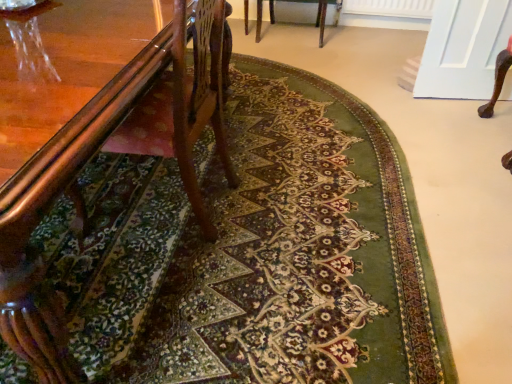
Question: In terms of width, does wooden chair at center, acting as the first chair starting from the back, look wider or thinner when compared to wooden chair at left, positioned as the 1th chair in bottom-to-top order?

Choices:
 (A) thin
 (B) wide

Answer: (A)

Question: Relative to wooden chair at left, arranged as the 2th chair when viewed from the right, is wooden chair at center, which is the first chair in right-to-left order, in front or behind?

Choices:
 (A) behind
 (B) front

Answer: (A)

Question: From a real-world perspective, is wooden chair at center, which is the second chair from front to back, positioned above or below wooden chair at left, arranged as the second chair when viewed from the top?

Choices:
 (A) below
 (B) above

Answer: (A)

Question: From a real-world perspective, is wooden chair at left, arranged as the second chair when viewed from the top, above or below wooden chair at center, which is the second chair from front to back?

Choices:
 (A) above
 (B) below

Answer: (A)

Question: Based on their positions, is wooden chair at left, the second chair viewed from the back, located to the left or right of wooden chair at center, acting as the first chair starting from the back?

Choices:
 (A) left
 (B) right

Answer: (A)

Question: From the image's perspective, is wooden chair at left, the 1th chair when ordered from left to right, above or below wooden chair at center, which is the second chair from front to back?

Choices:
 (A) above
 (B) below

Answer: (B)

Question: Considering the positions of wooden chair at left, positioned as the 1th chair in bottom-to-top order, and wooden chair at center, which is counted as the 2th chair, starting from the bottom, in the image, is wooden chair at left, positioned as the 1th chair in bottom-to-top order, bigger or smaller than wooden chair at center, which is counted as the 2th chair, starting from the bottom,?

Choices:
 (A) big
 (B) small

Answer: (A)